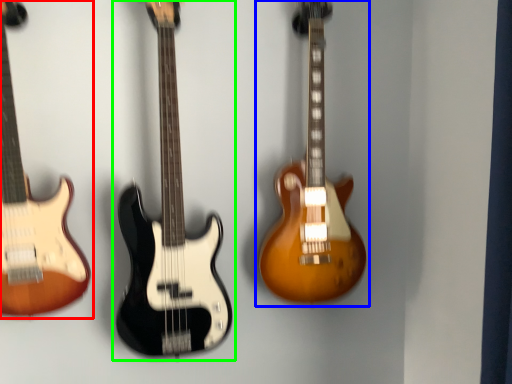
Question: Estimate the real-world distances between objects in this image. Which object is closer to guitar (highlighted by a red box), guitar (highlighted by a blue box) or guitar (highlighted by a green box)?

Choices:
 (A) guitar
 (B) guitar

Answer: (B)